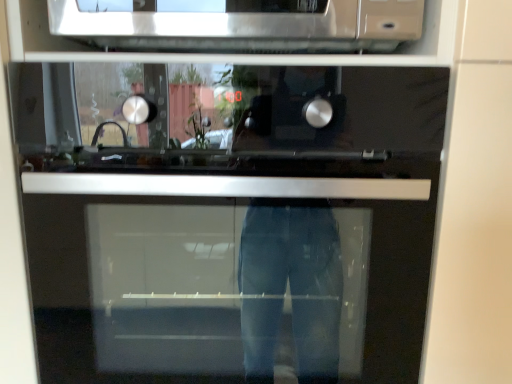
Find the location of a particular element. This screenshot has width=512, height=384. vacant point above stainless steel oven at center (from a real-world perspective) is located at coordinates (223, 59).